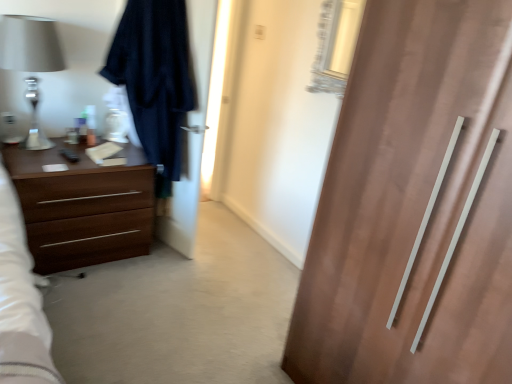
At what (x,y) coordinates should I click in order to perform the action: click on free space below matte silver lamp at left (from a real-world perspective). Please return your answer as a coordinate pair (x, y). The height and width of the screenshot is (384, 512). Looking at the image, I should click on (47, 150).